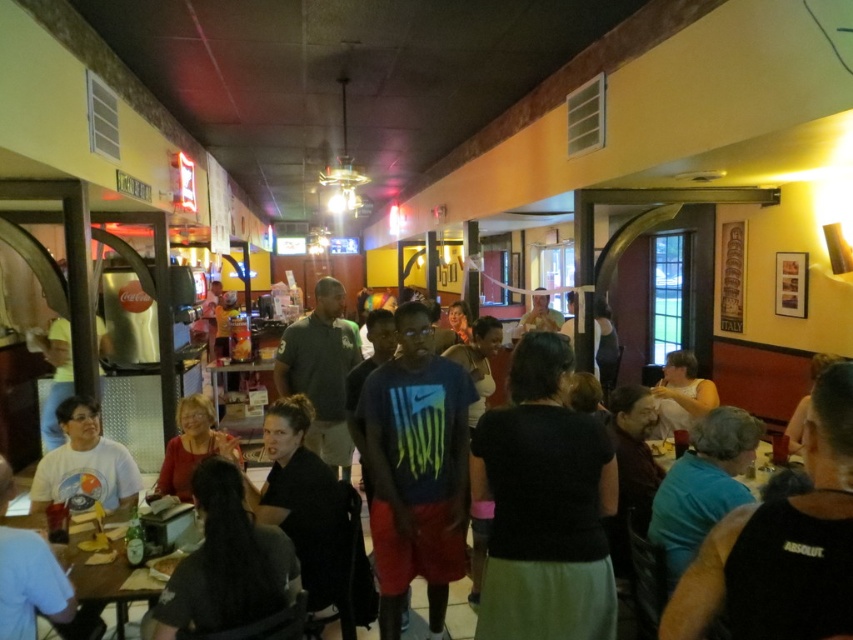
You are a server in this restaurant and need to deliver a drink to the wooden table at center. You notice a person wearing a blue fabric shirt at lower right nearby. Can you easily reach the table without stepping over the person?

The blue fabric shirt at lower right is smaller than the wooden table at center, so the person is likely closer to the table. You should check their exact position before deciding the best path to reach the table.

You are a photographer trying to capture a group photo of the dark gray shirt at lower left and the matte red shirt at center. Since you want to ensure both subjects are in focus, you need to know which one is wider. Which shirt has a greater width?

The dark gray shirt at lower left has a greater width than the matte red shirt at center.

You are a waiter in the restaurant and need to deliver a drink to the person wearing the dark gray shirt at lower left and the matte red shirt at center. Which customer should you approach first if you are standing at the entrance door located to the right of the restaurant?

The dark gray shirt at lower left is positioned on the right side of matte red shirt at center. Since you are standing at the entrance door to the right of the restaurant, the dark gray shirt at lower left is closer to you and should be approached first.